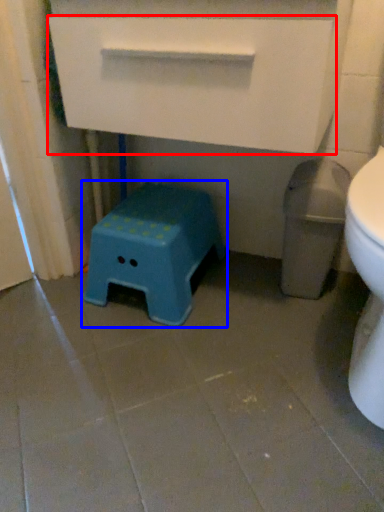
Question: Which of the following is the farthest to the observer, drawer (highlighted by a red box) or stool (highlighted by a blue box)?

Choices:
 (A) drawer
 (B) stool

Answer: (B)